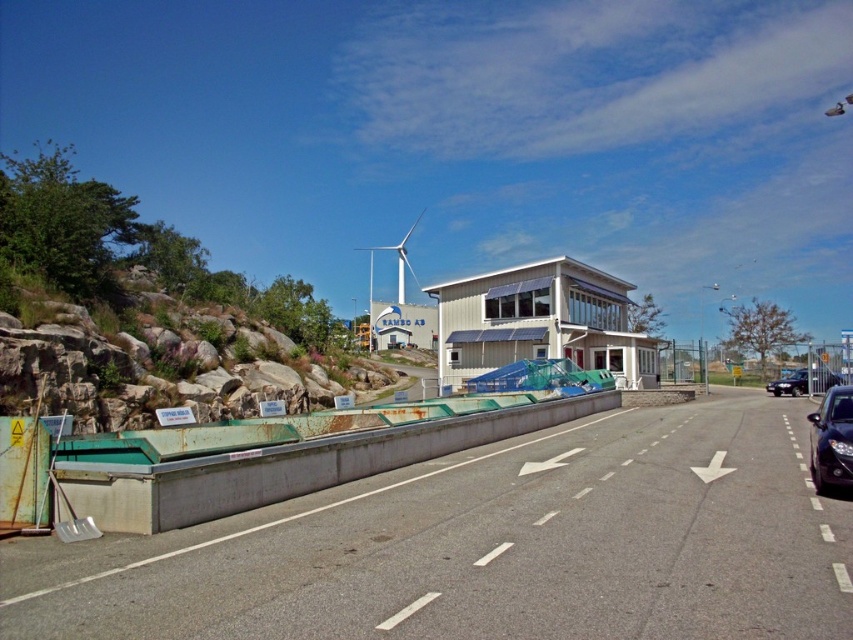
Which of these two, green concrete highway at lower left or rusty rock at left, stands shorter?

Standing shorter between the two is green concrete highway at lower left.

Can you confirm if green concrete highway at lower left is wider than rusty rock at left?

Yes, green concrete highway at lower left is wider than rusty rock at left.

Find the location of a particular element. This screenshot has width=853, height=640. green concrete highway at lower left is located at coordinates (490, 547).

Does green concrete highway at lower left appear over rusty metal barrier at lower left?

No.

The height and width of the screenshot is (640, 853). I want to click on green concrete highway at lower left, so click(x=490, y=547).

Which is in front, point (276, 566) or point (426, 428)?

Point (276, 566) is in front.

Where is `green concrete highway at lower left`? The height and width of the screenshot is (640, 853). green concrete highway at lower left is located at coordinates (x=490, y=547).

Can you confirm if rusty metal barrier at lower left is positioned below dark blue metallic car at right?

Incorrect, rusty metal barrier at lower left is not positioned below dark blue metallic car at right.

Who is more distant from viewer, (410, 428) or (785, 388)?

Point (785, 388)

You are a GUI agent. You are given a task and a screenshot of the screen. Output one action in this format:
    pyautogui.click(x=<x>, y=<y>)
    Task: Click on the rusty metal barrier at lower left
    This screenshot has height=640, width=853.
    Given the screenshot: What is the action you would take?
    pyautogui.click(x=288, y=467)